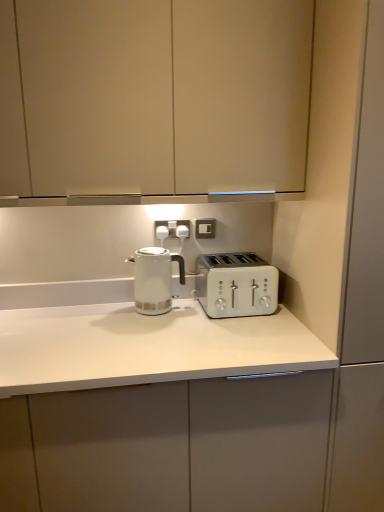
Question: Considering the positions of white plastic toaster at center and white glossy kettle at center in the image, is white plastic toaster at center bigger or smaller than white glossy kettle at center?

Choices:
 (A) big
 (B) small

Answer: (A)

Question: From the image's perspective, is white plastic toaster at center positioned above or below white glossy kettle at center?

Choices:
 (A) below
 (B) above

Answer: (A)

Question: Based on their relative distances, which object is nearer to the white plastic toaster at center?

Choices:
 (A) white plastic electric outlet at center, positioned as the second electric outlet in left-to-right order
 (B) white plastic electrical outlet at center, acting as the 2th electric outlet starting from the right
 (C) white glossy countertop at center, which appears as the second cabinetry when viewed from the top
 (D) matte white cabinet at upper center, the 2th cabinetry positioned from the bottom
 (E) white glossy kettle at center

Answer: (E)

Question: Which is farther from the white plastic toaster at center?

Choices:
 (A) white plastic electric outlet at center, positioned as the second electric outlet in left-to-right order
 (B) white glossy kettle at center
 (C) white glossy countertop at center, which is the first cabinetry in bottom-to-top order
 (D) matte white cabinet at upper center, which is the 1th cabinetry in top-to-bottom order
 (E) white plastic electrical outlet at center, acting as the 2th electric outlet starting from the right

Answer: (D)